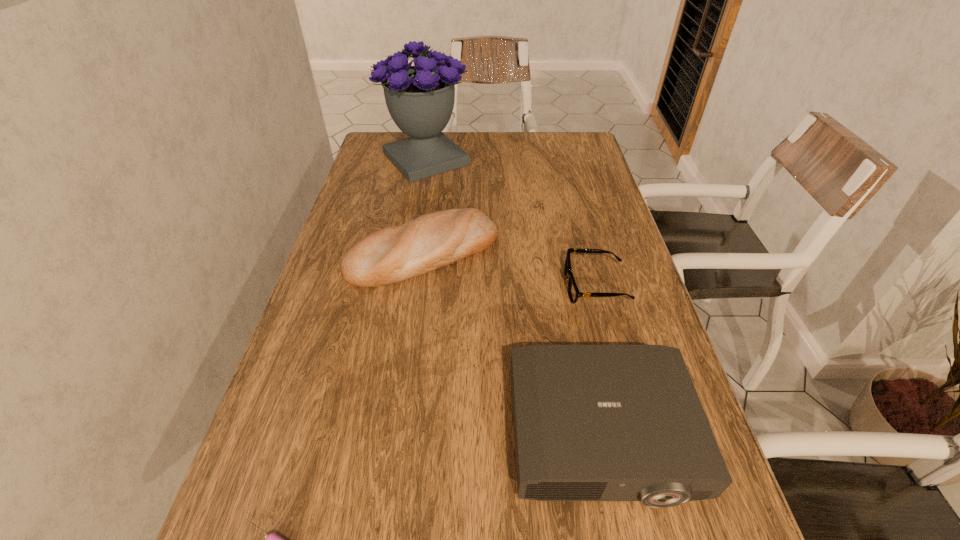
The image size is (960, 540). Find the location of `free space that is in between the tallest object and the sunglasses`. free space that is in between the tallest object and the sunglasses is located at coordinates (511, 222).

Locate an element on the screen. empty location between the bouquet and the sunglasses is located at coordinates (511, 222).

Identify the location of free space between the sunglasses and the bread. The width and height of the screenshot is (960, 540). (510, 269).

Identify the location of object that ranks as the fourth closest to the bouquet. The width and height of the screenshot is (960, 540). (273, 539).

Find the location of `object that ranks as the third closest to the syringe`. object that ranks as the third closest to the syringe is located at coordinates (573, 291).